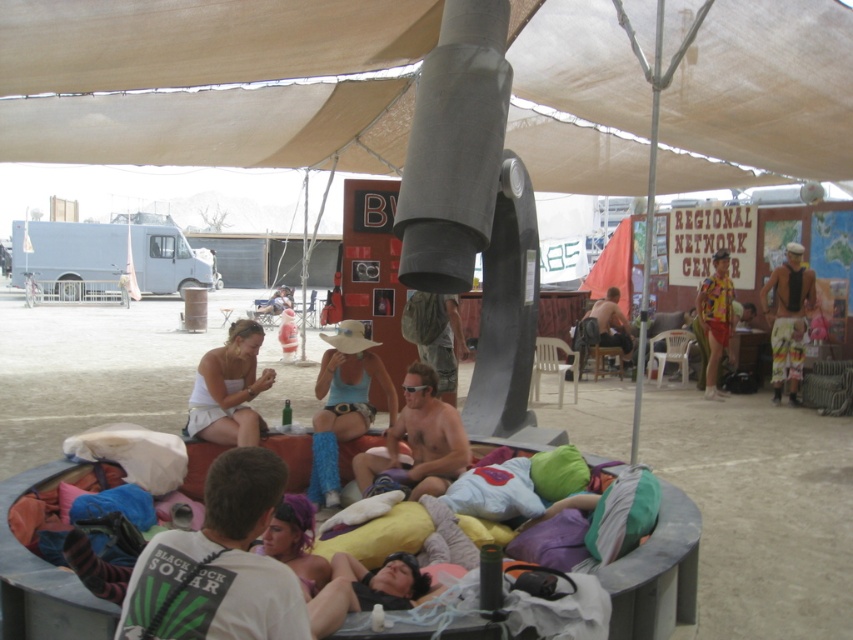
Question: Which point is closer to the camera taking this photo?

Choices:
 (A) (775, 310)
 (B) (321, 356)
 (C) (433, 392)
 (D) (608, 44)

Answer: (C)

Question: From the image, what is the correct spatial relationship of camouflage fabric pants at center in relation to purple fabric at center?

Choices:
 (A) left
 (B) right

Answer: (B)

Question: Which object is closer to the camera taking this photo?

Choices:
 (A) shiny silver sunglasses at center
 (B) white cotton shirt at center

Answer: (A)

Question: Which point is farther to the camera?

Choices:
 (A) (457, 468)
 (B) (201, 570)
 (C) (352, 330)

Answer: (C)

Question: Is shiny silver sunglasses at center in front of matte blue fabric at center?

Choices:
 (A) no
 (B) yes

Answer: (B)

Question: Considering the relative positions of shiny silver sunglasses at center and camouflage fabric pants at center in the image provided, where is shiny silver sunglasses at center located with respect to camouflage fabric pants at center?

Choices:
 (A) above
 (B) below

Answer: (B)